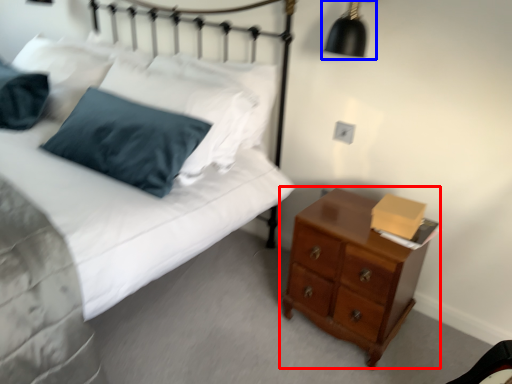
Question: Which object is further to the camera taking this photo, chest of drawers (highlighted by a red box) or lamp (highlighted by a blue box)?

Choices:
 (A) chest of drawers
 (B) lamp

Answer: (B)